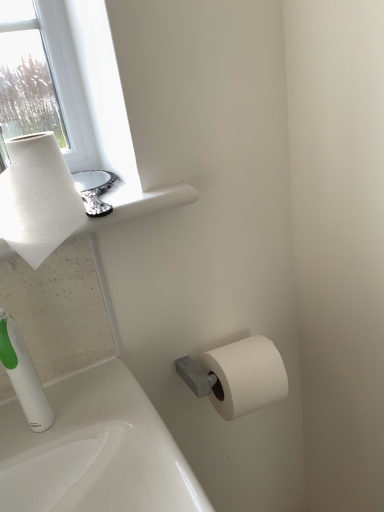
Describe the element at coordinates (137, 204) in the screenshot. Image resolution: width=384 pixels, height=512 pixels. I see `white matte paper towel at upper left` at that location.

The image size is (384, 512). What do you see at coordinates (37, 198) in the screenshot? I see `white textured paper towel at upper left` at bounding box center [37, 198].

Locate an element on the screen. white matte paper towel at upper left is located at coordinates point(137,204).

Can you confirm if white textured paper towel at upper left is smaller than white matte paper towel at upper left?

Correct, white textured paper towel at upper left occupies less space than white matte paper towel at upper left.

From a real-world perspective, is white textured paper towel at upper left physically above white matte paper towel at upper left?

Correct, in the physical world, white textured paper towel at upper left is higher than white matte paper towel at upper left.

Looking at this image, between white matte toilet paper at lower right and white textured paper towel at upper left, which one is positioned behind?

white matte toilet paper at lower right is further from the camera.

Is white matte toilet paper at lower right wider or thinner than white textured paper towel at upper left?

Clearly, white matte toilet paper at lower right has more width compared to white textured paper towel at upper left.

Is white matte toilet paper at lower right inside the boundaries of white textured paper towel at upper left, or outside?

white matte toilet paper at lower right is located beyond the bounds of white textured paper towel at upper left.

The height and width of the screenshot is (512, 384). Identify the location of toilet paper on the right of white textured paper towel at upper left. (246, 376).

Between point (61, 236) and point (39, 410), which one is positioned in front?

The point (61, 236) is closer.

From the image's perspective, is white textured paper towel at upper left positioned above or below white plastic soap dispenser at lower left?

Clearly, from the image's perspective, white textured paper towel at upper left is above white plastic soap dispenser at lower left.

Who is smaller, white textured paper towel at upper left or white plastic soap dispenser at lower left?

white plastic soap dispenser at lower left is smaller.

Which object is positioned more to the left, white textured paper towel at upper left or white plastic soap dispenser at lower left?

Positioned to the left is white plastic soap dispenser at lower left.

Is point (118, 211) in front of point (262, 376)?

Yes, point (118, 211) is in front of point (262, 376).

Is white matte paper towel at upper left situated inside white matte toilet paper at lower right or outside?

white matte paper towel at upper left is not inside white matte toilet paper at lower right, it's outside.

Considering the sizes of objects white matte paper towel at upper left and white matte toilet paper at lower right in the image provided, who is wider, white matte paper towel at upper left or white matte toilet paper at lower right?

With larger width is white matte paper towel at upper left.

Is white matte paper towel at upper left further to camera compared to white matte toilet paper at lower right?

No, it is in front of white matte toilet paper at lower right.

Is white plastic soap dispenser at lower left spatially inside white textured paper towel at upper left, or outside of it?

white plastic soap dispenser at lower left cannot be found inside white textured paper towel at upper left.

Which of these two, white plastic soap dispenser at lower left or white textured paper towel at upper left, is smaller?

With smaller size is white plastic soap dispenser at lower left.

Are white plastic soap dispenser at lower left and white textured paper towel at upper left making contact?

white plastic soap dispenser at lower left and white textured paper towel at upper left are not in contact.

How much distance is there between white plastic soap dispenser at lower left and white textured paper towel at upper left?

5.56 inches.

Is white matte toilet paper at lower right next to white matte paper towel at upper left and touching it?

white matte toilet paper at lower right is not next to white matte paper towel at upper left, and they're not touching.

From a real-world perspective, which object rests below the other?

From a 3D spatial view, white matte toilet paper at lower right is below.

Which of these two, white matte toilet paper at lower right or white matte paper towel at upper left, stands taller?

white matte toilet paper at lower right is taller.

From the image's perspective, which is below, white matte toilet paper at lower right or white matte paper towel at upper left?

white matte toilet paper at lower right is shown below in the image.

What's the angular difference between white matte toilet paper at lower right and white plastic soap dispenser at lower left's facing directions?

The angle between the facing direction of white matte toilet paper at lower right and the facing direction of white plastic soap dispenser at lower left is 1.19 degrees.

Looking at their sizes, would you say white matte toilet paper at lower right is wider or thinner than white plastic soap dispenser at lower left?

white matte toilet paper at lower right is wider than white plastic soap dispenser at lower left.

Which is more to the left, white matte toilet paper at lower right or white plastic soap dispenser at lower left?

Positioned to the left is white plastic soap dispenser at lower left.

Image resolution: width=384 pixels, height=512 pixels. Find the location of `paper towel below the white matte paper towel at upper left (from the image's perspective)`. paper towel below the white matte paper towel at upper left (from the image's perspective) is located at coordinates (37, 198).

This screenshot has width=384, height=512. Identify the location of toilet paper located behind the white textured paper towel at upper left. (246, 376).

Which object lies further to the anchor point white matte paper towel at upper left, white matte toilet paper at lower right or white textured paper towel at upper left?

The object further to white matte paper towel at upper left is white matte toilet paper at lower right.

Consider the image. From the image, which object appears to be farther from white plastic soap dispenser at lower left, white matte paper towel at upper left or white textured paper towel at upper left?

white matte paper towel at upper left lies further to white plastic soap dispenser at lower left than the other object.

Considering their positions, is white plastic soap dispenser at lower left positioned further to white matte paper towel at upper left than white matte toilet paper at lower right?

white matte toilet paper at lower right.

Considering their positions, is white matte toilet paper at lower right positioned further to white plastic soap dispenser at lower left than white textured paper towel at upper left?

white matte toilet paper at lower right is further to white plastic soap dispenser at lower left.

Which object lies further to the anchor point white matte toilet paper at lower right, white matte paper towel at upper left or white textured paper towel at upper left?

white textured paper towel at upper left lies further to white matte toilet paper at lower right than the other object.

Based on the photo, estimate the real-world distances between objects in this image. Which object is further from white matte paper towel at upper left, white textured paper towel at upper left or white matte toilet paper at lower right?

white matte toilet paper at lower right.

Based on their spatial positions, is white matte toilet paper at lower right or white matte paper towel at upper left further from white textured paper towel at upper left?

white matte toilet paper at lower right is positioned further to the anchor white textured paper towel at upper left.

When comparing their distances from white textured paper towel at upper left, does white plastic soap dispenser at lower left or white matte toilet paper at lower right seem further?

white matte toilet paper at lower right is positioned further to the anchor white textured paper towel at upper left.

In order to click on paper towel between white plastic soap dispenser at lower left and white matte toilet paper at lower right from left to right in this screenshot , I will do pos(37,198).

Find the location of a particular element. This screenshot has width=384, height=512. paper towel between white matte paper towel at upper left and white plastic soap dispenser at lower left in the up-down direction is located at coordinates (37, 198).

What are the coordinates of `paper towel that lies between white matte paper towel at upper left and white matte toilet paper at lower right from top to bottom` in the screenshot? It's located at (37, 198).

Find the location of a particular element. This screenshot has width=384, height=512. window sill between white plastic soap dispenser at lower left and white matte toilet paper at lower right from left to right is located at coordinates (137, 204).